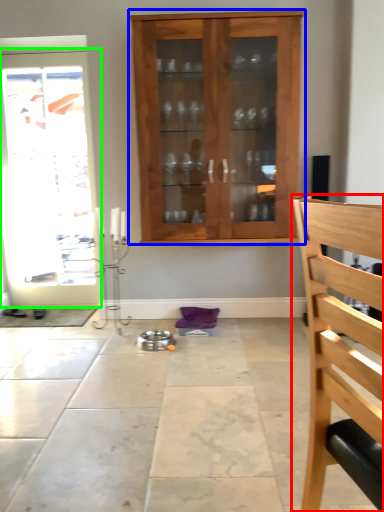
Question: Which object is the farthest from chair (highlighted by a red box)? Choose among these: cabinetry (highlighted by a blue box) or door (highlighted by a green box).

Choices:
 (A) cabinetry
 (B) door

Answer: (B)